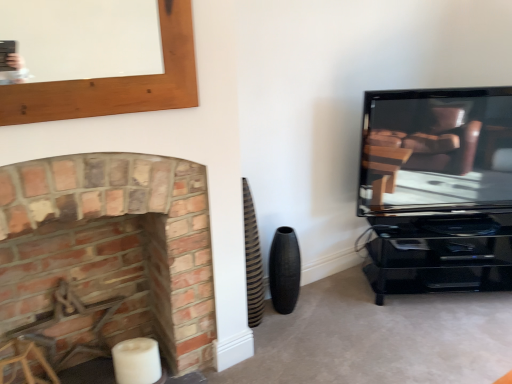
Question: Could you tell me if matte black tv at right is facing black textured vase at lower center?

Choices:
 (A) yes
 (B) no

Answer: (B)

Question: Can you confirm if matte black tv at right is wider than black textured vase at lower center?

Choices:
 (A) no
 (B) yes

Answer: (B)

Question: From a real-world perspective, is matte black tv at right located beneath black textured vase at lower center?

Choices:
 (A) yes
 (B) no

Answer: (B)

Question: From the image's perspective, is matte black tv at right on black textured vase at lower center?

Choices:
 (A) yes
 (B) no

Answer: (A)

Question: From a real-world perspective, is matte black tv at right over black textured vase at lower center?

Choices:
 (A) yes
 (B) no

Answer: (A)

Question: Does matte black tv at right appear on the right side of black textured vase at lower center?

Choices:
 (A) no
 (B) yes

Answer: (B)

Question: Is brick fireplace at left aimed at black textured vase at lower center?

Choices:
 (A) yes
 (B) no

Answer: (B)

Question: Is the surface of brick fireplace at left in direct contact with black textured vase at lower center?

Choices:
 (A) yes
 (B) no

Answer: (B)

Question: Can you confirm if brick fireplace at left is smaller than black textured vase at lower center?

Choices:
 (A) no
 (B) yes

Answer: (A)

Question: Is brick fireplace at left taller than black textured vase at lower center?

Choices:
 (A) no
 (B) yes

Answer: (B)

Question: Considering the relative sizes of brick fireplace at left and black textured vase at lower center in the image provided, is brick fireplace at left wider than black textured vase at lower center?

Choices:
 (A) yes
 (B) no

Answer: (A)

Question: Would you say brick fireplace at left contains black textured vase at lower center?

Choices:
 (A) no
 (B) yes

Answer: (A)

Question: From a real-world perspective, is black textured vase at lower center under brick fireplace at left?

Choices:
 (A) yes
 (B) no

Answer: (A)